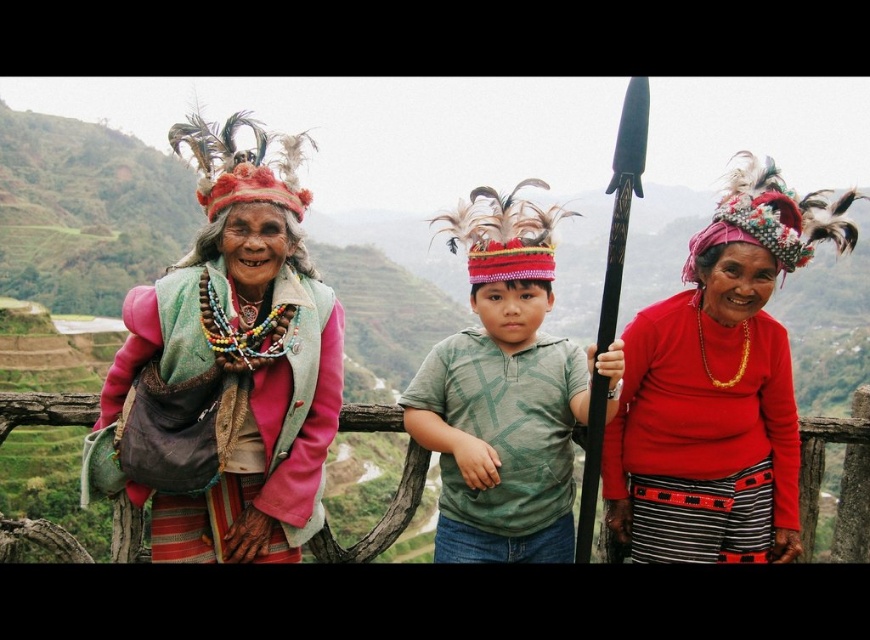
Is green cotton shirt at center above multicolored beaded necklace at center?

Yes, green cotton shirt at center is above multicolored beaded necklace at center.

Is green cotton shirt at center taller than multicolored beaded necklace at center?

Yes, green cotton shirt at center is taller than multicolored beaded necklace at center.

Does point (519, 394) lie in front of point (182, 323)?

No.

Where is `green cotton shirt at center`? green cotton shirt at center is located at coordinates (502, 394).

The height and width of the screenshot is (640, 870). Describe the element at coordinates (718, 387) in the screenshot. I see `matte red sweater at center` at that location.

Who is positioned more to the right, matte red sweater at center or green cotton shirt at center?

matte red sweater at center

The image size is (870, 640). Describe the element at coordinates (718, 387) in the screenshot. I see `matte red sweater at center` at that location.

Identify the location of matte red sweater at center. The height and width of the screenshot is (640, 870). (718, 387).

What do you see at coordinates (718, 387) in the screenshot? This screenshot has width=870, height=640. I see `matte red sweater at center` at bounding box center [718, 387].

Measure the distance from matte red sweater at center to multicolored beaded necklace at center.

matte red sweater at center is 13.23 meters away from multicolored beaded necklace at center.

Is point (681, 464) more distant than point (305, 381)?

Yes, point (681, 464) is farther from viewer.

The image size is (870, 640). What are the coordinates of `matte red sweater at center` in the screenshot? It's located at (718, 387).